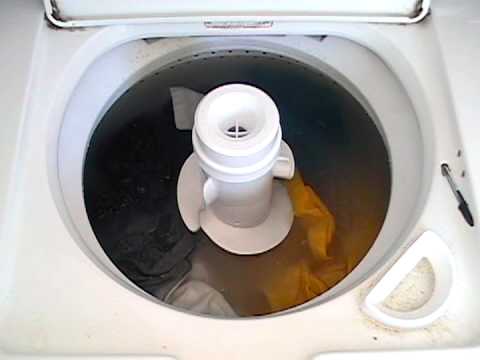
What are the coordinates of `top loading washer surface` in the screenshot? It's located at (33, 199).